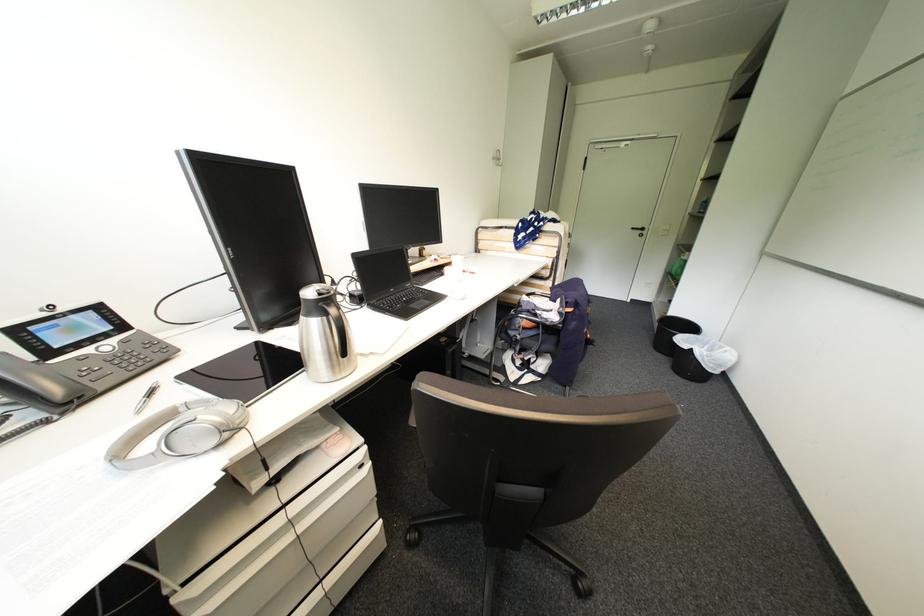
The height and width of the screenshot is (616, 924). Describe the element at coordinates (322, 291) in the screenshot. I see `a thermos lid button` at that location.